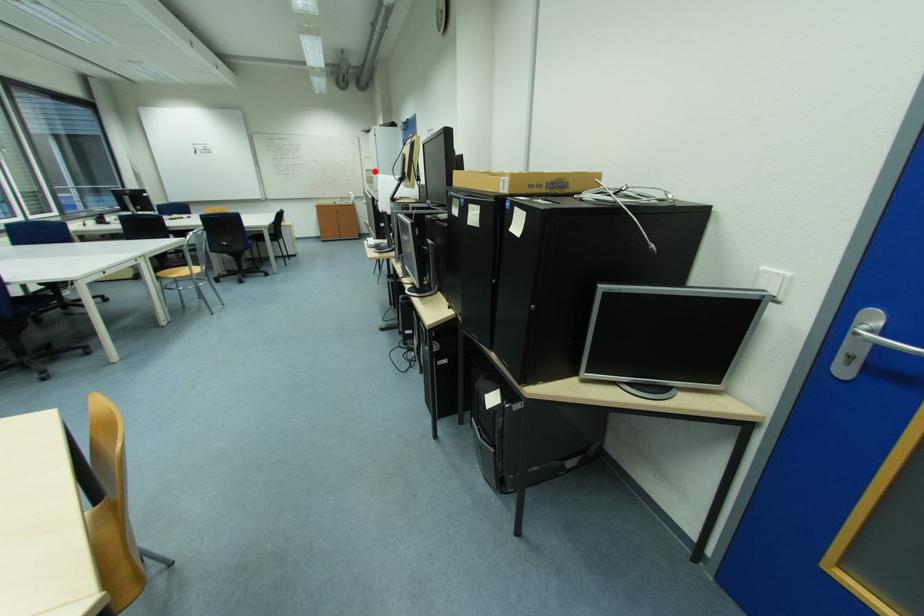
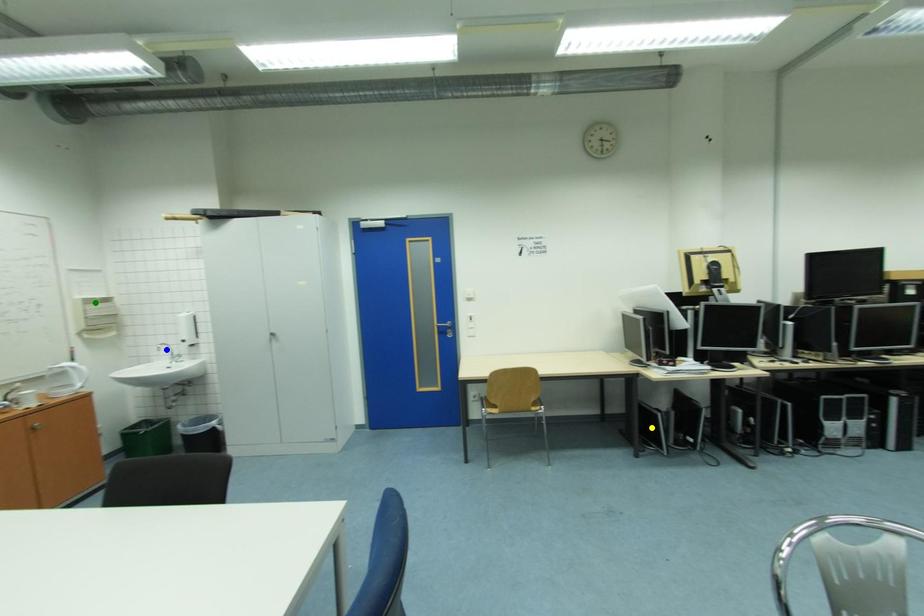
Question: I am providing you with two images of the same scene from different viewpoints. A red point is marked on the first image. You are given multiple points on the second image. Which point in image 2 is actually the same real-world point as the red point in image 1?

Choices:
 (A) blue point
 (B) yellow point
 (C) green point

Answer: (C)